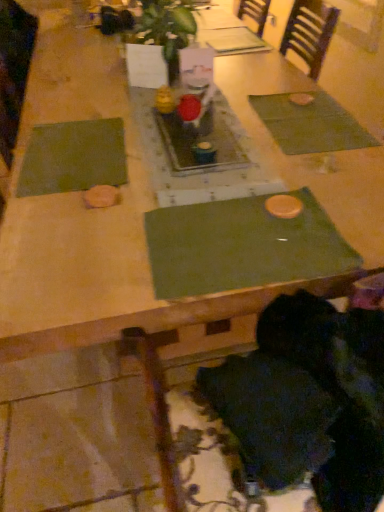
The width and height of the screenshot is (384, 512). I want to click on vacant area that is in front of green fabric placemat at upper right, which is counted as the first place mat, starting from the right, so click(x=330, y=173).